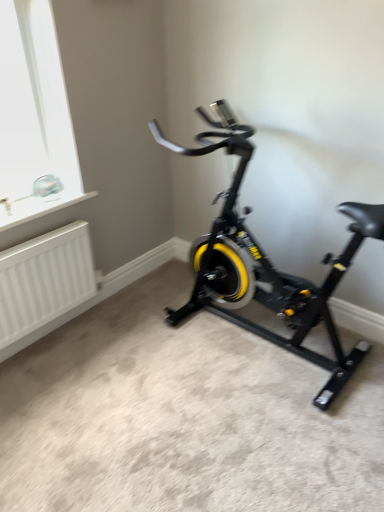
Where is `free location to the left of black matte stationary bicycle at center`? free location to the left of black matte stationary bicycle at center is located at coordinates click(131, 362).